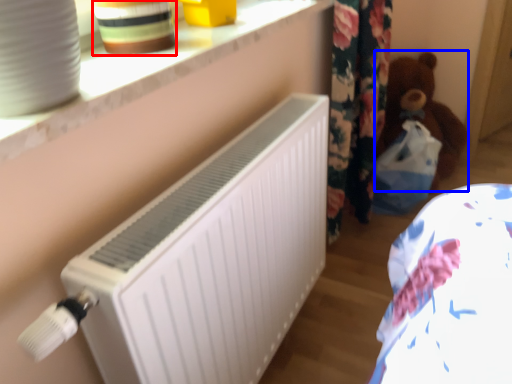
Question: Which object appears closest to the camera in this image, pottery (highlighted by a red box) or teddy (highlighted by a blue box)?

Choices:
 (A) pottery
 (B) teddy

Answer: (A)